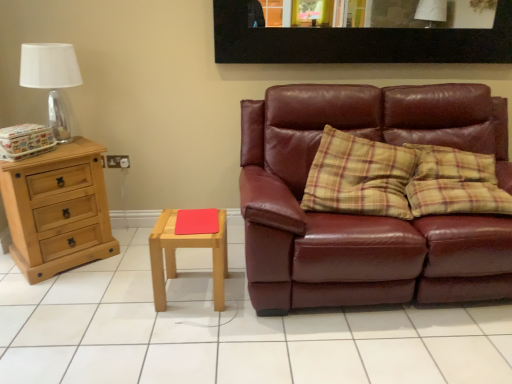
This screenshot has width=512, height=384. Identify the location of free location in front of natural wood chest of drawers at left. (55, 293).